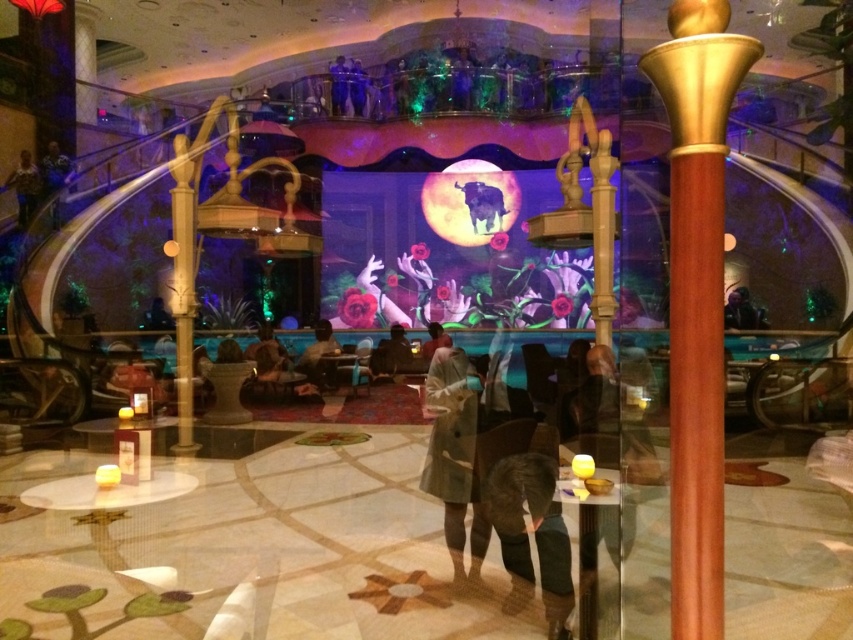
Question: Which object is farther from the camera taking this photo?

Choices:
 (A) light brown leather jacket at center
 (B) camouflage jacket at upper left
 (C) light brown wool coat at center
 (D) wooden column at center

Answer: (B)

Question: Does wooden polished pole at right appear under wooden column at center?

Choices:
 (A) no
 (B) yes

Answer: (B)

Question: Does wooden column at center have a larger size compared to camouflage jacket at upper left?

Choices:
 (A) yes
 (B) no

Answer: (A)

Question: Which of the following is the closest to the observer?

Choices:
 (A) (490, 500)
 (B) (670, 436)

Answer: (B)

Question: Considering the relative positions of wooden polished pole at right and light brown wool coat at center in the image provided, where is wooden polished pole at right located with respect to light brown wool coat at center?

Choices:
 (A) below
 (B) above

Answer: (B)

Question: Which object appears closest to the camera in this image?

Choices:
 (A) wooden column at center
 (B) camouflage jacket at upper left

Answer: (A)